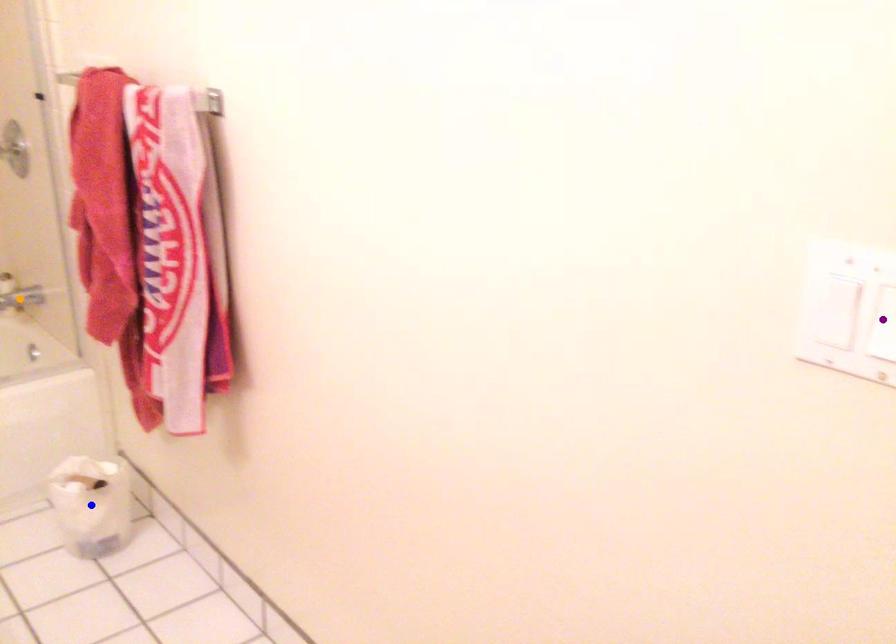
Order these from farthest to nearest:
orange point | blue point | purple point

orange point, blue point, purple point